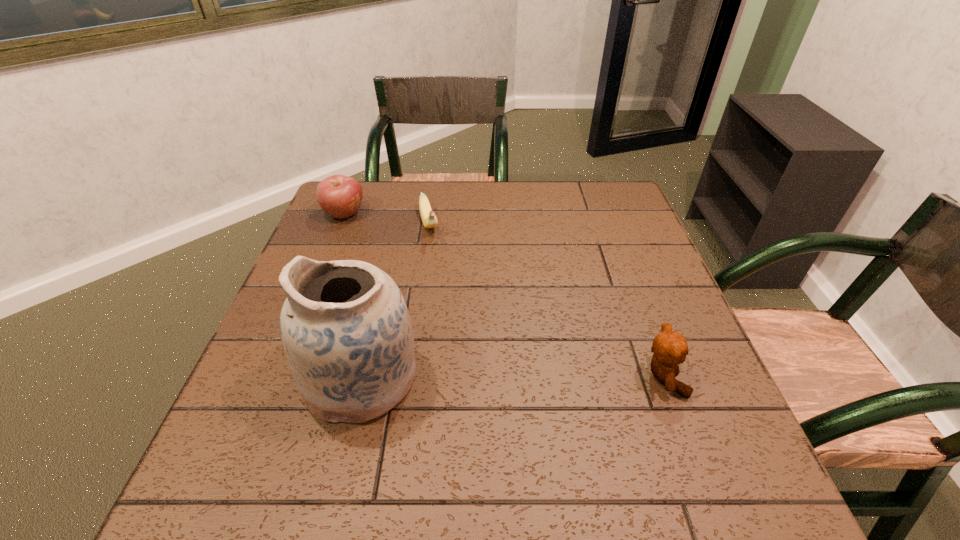
Identify the location of vacant space that satisfies the following two spatial constraints: 1. on the front side of the tallest object; 2. on the left side of the apple. (277, 377).

At what (x,y) coordinates should I click in order to perform the action: click on vacant area that satisfies the following two spatial constraints: 1. on the front side of the rightmost object; 2. on the front-facing side of the banana. Please return your answer as a coordinate pair (x, y). The width and height of the screenshot is (960, 540). Looking at the image, I should click on (406, 377).

At what (x,y) coordinates should I click in order to perform the action: click on blank space that satisfies the following two spatial constraints: 1. on the front side of the teddy bear; 2. on the front-facing side of the banana. Please return your answer as a coordinate pair (x, y). This screenshot has width=960, height=540. Looking at the image, I should click on (406, 377).

The height and width of the screenshot is (540, 960). Find the location of `vacant area in the image that satisfies the following two spatial constraints: 1. on the back side of the tallest object; 2. on the right side of the banana`. vacant area in the image that satisfies the following two spatial constraints: 1. on the back side of the tallest object; 2. on the right side of the banana is located at coordinates (398, 225).

Locate an element on the screen. free space that satisfies the following two spatial constraints: 1. on the front side of the apple; 2. on the front-facing side of the rightmost object is located at coordinates (277, 377).